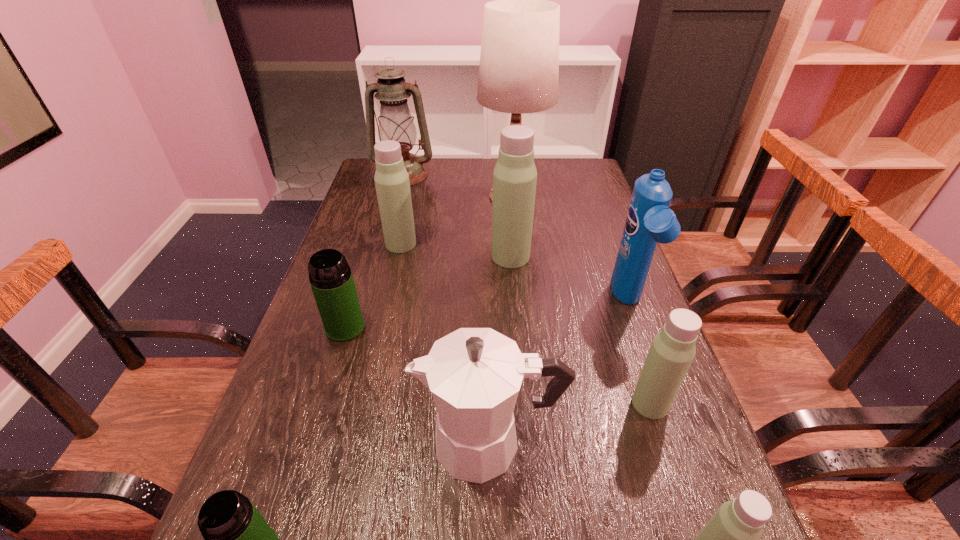
Image resolution: width=960 pixels, height=540 pixels. In the image, there is a desktop. Find the location of `vacant space at the right edge`. vacant space at the right edge is located at coordinates (602, 297).

The height and width of the screenshot is (540, 960). I want to click on vacant space at the far left corner of the desktop, so click(x=375, y=188).

Identify the location of free spot between the shampoo and the third biggest light thermos bottle. (639, 353).

The height and width of the screenshot is (540, 960). In order to click on free space that is in between the lamp and the shampoo in this screenshot , I will do `click(570, 249)`.

This screenshot has width=960, height=540. I want to click on free space between the oil lamp and the lamp, so click(x=457, y=185).

Identify the location of free space that is in between the third nearest thermos bottle and the gray coffeepot. Image resolution: width=960 pixels, height=540 pixels. (569, 423).

Find the location of a particular element. The height and width of the screenshot is (540, 960). vacant area that lies between the lamp and the gray coffeepot is located at coordinates (500, 319).

At what (x,y) coordinates should I click in order to perform the action: click on free spot between the tallest object and the third smallest light thermos bottle. Please return your answer as a coordinate pair (x, y). The image size is (960, 540). Looking at the image, I should click on (457, 220).

Locate which object is the fifth closest to the third nearest thermos bottle. Please provide its 2D coordinates. Your answer should be formatted as a tuple, i.e. [(x, y)], where the tuple contains the x and y coordinates of a point satisfying the conditions above.

[(331, 279)]

At what (x,y) coordinates should I click in order to perform the action: click on object that is the fourth closest to the shampoo. Please return your answer as a coordinate pair (x, y). The height and width of the screenshot is (540, 960). Looking at the image, I should click on (519, 62).